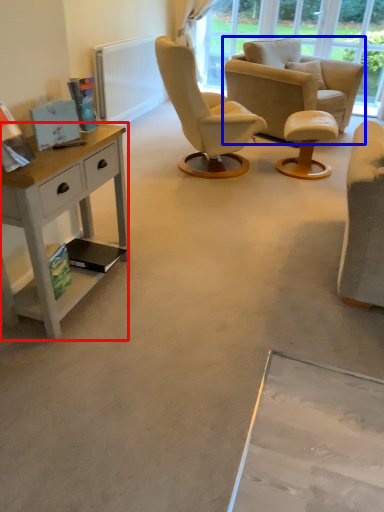
Question: Which point is closer to the camera, desk (highlighted by a red box) or chair (highlighted by a blue box)?

Choices:
 (A) desk
 (B) chair

Answer: (A)